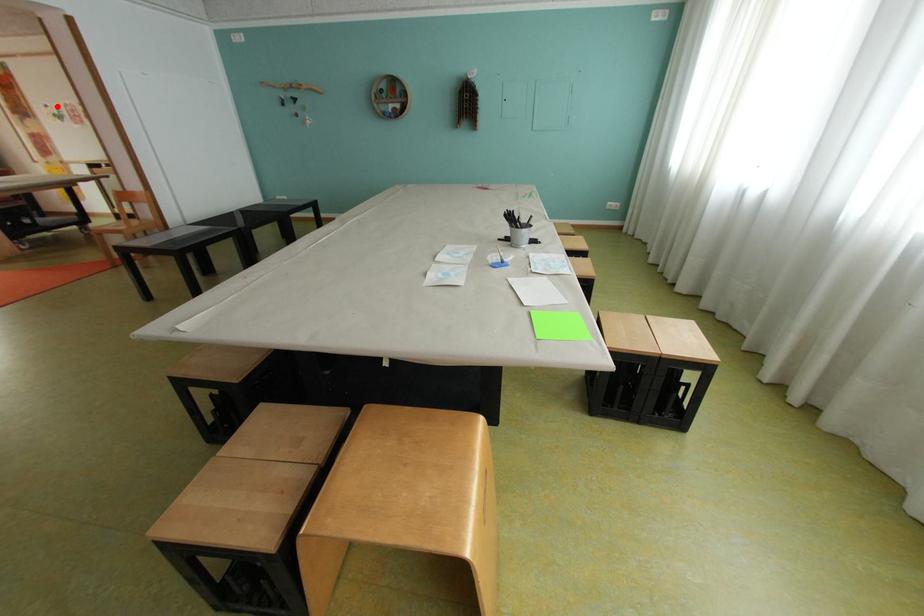
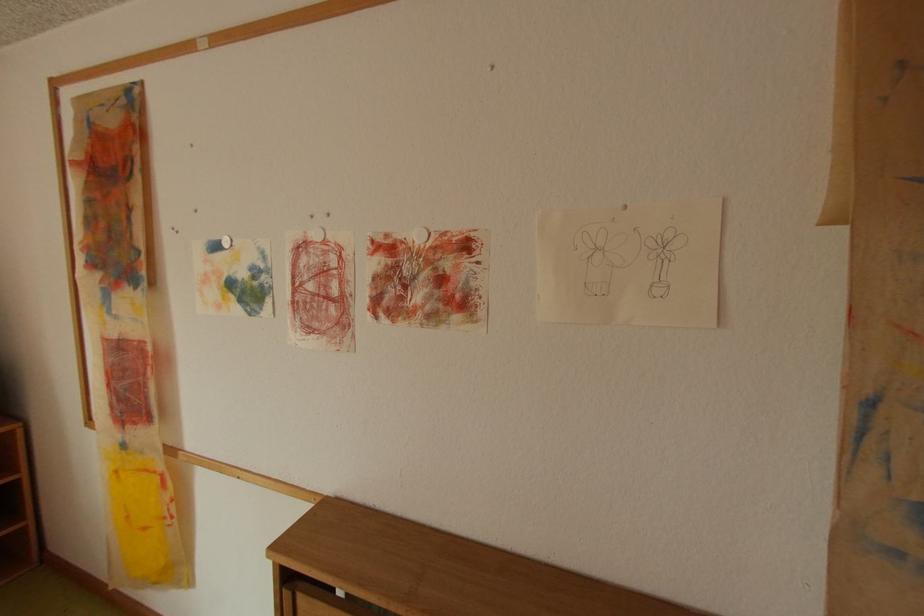
Question: I am providing you with two images of the same scene from different viewpoints. In image1, a red point is highlighted. Considering the same 3D point in image2, which of the following is correct?

Choices:
 (A) It is closer
 (B) It is farther

Answer: (A)